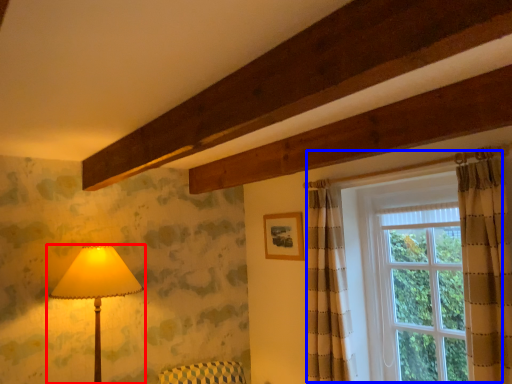
Question: Which point is closer to the camera, lamp (highlighted by a red box) or window (highlighted by a blue box)?

Choices:
 (A) lamp
 (B) window

Answer: (B)